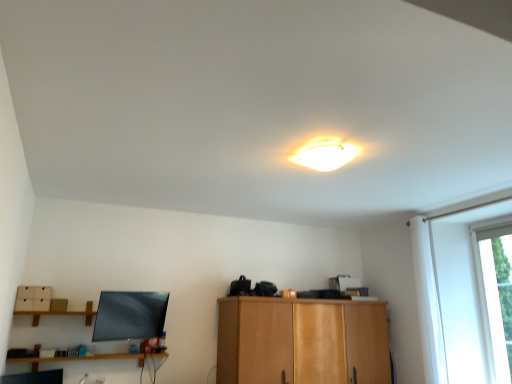
Question: From the image's perspective, relative to wooden cabinet at center, is transparent glass window at right above or below?

Choices:
 (A) above
 (B) below

Answer: (A)

Question: In terms of height, does transparent glass window at right look taller or shorter compared to wooden cabinet at center?

Choices:
 (A) short
 (B) tall

Answer: (B)

Question: Estimate the real-world distances between objects in this image. Which object is closer to the white glossy ceiling light at upper center?

Choices:
 (A) transparent glass window at right
 (B) wooden shelf at lower left
 (C) wooden cabinet at center

Answer: (C)

Question: Which is nearer to the transparent glass window at right?

Choices:
 (A) wooden cabinet at center
 (B) white glossy ceiling light at upper center
 (C) wooden shelf at lower left

Answer: (A)